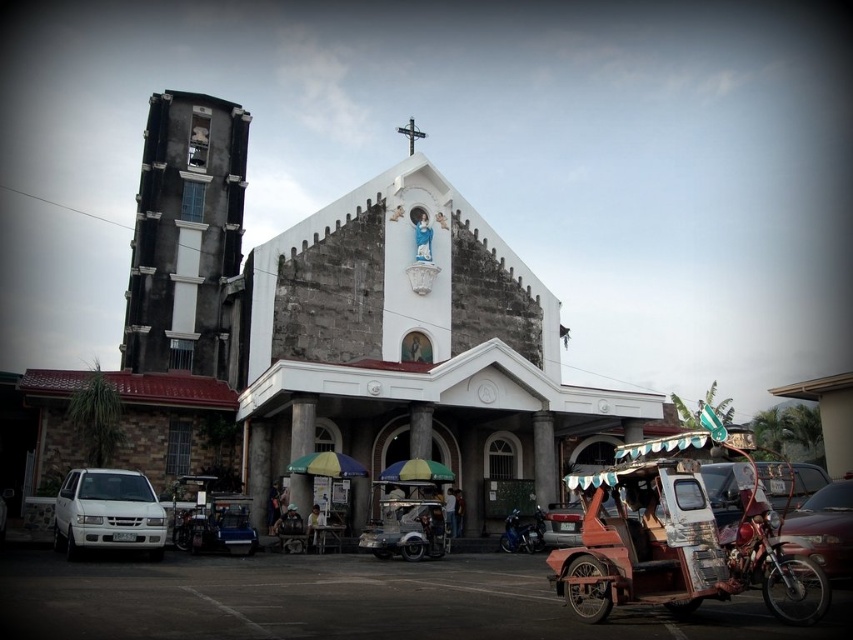
Question: Which of the following is the farthest from the observer?

Choices:
 (A) white stone chapel at center
 (B) metallic red car at center

Answer: (A)

Question: Which is farther from the rusty metal cart at lower right?

Choices:
 (A) metallic red car at center
 (B) white stone chapel at center

Answer: (B)

Question: Considering the relative positions of white matte van at lower left and shiny blue motorcycle at lower center in the image provided, where is white matte van at lower left located with respect to shiny blue motorcycle at lower center?

Choices:
 (A) above
 (B) below

Answer: (A)

Question: Which point is closer to the camera taking this photo?

Choices:
 (A) (88, 490)
 (B) (553, 532)
 (C) (512, 534)

Answer: (A)

Question: Does white stone chapel at center have a smaller size compared to metallic red car at center?

Choices:
 (A) no
 (B) yes

Answer: (A)

Question: Is white stone chapel at center to the left of metallic silver tricycle at center from the viewer's perspective?

Choices:
 (A) yes
 (B) no

Answer: (B)